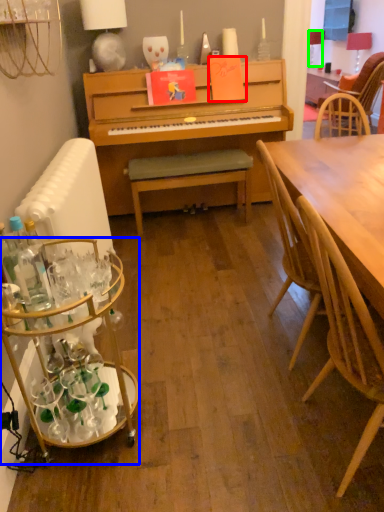
Question: Estimate the real-world distances between objects in this image. Which object is closer to book (highlighted by a red box), desk (highlighted by a blue box) or lamp (highlighted by a green box)?

Choices:
 (A) desk
 (B) lamp

Answer: (A)